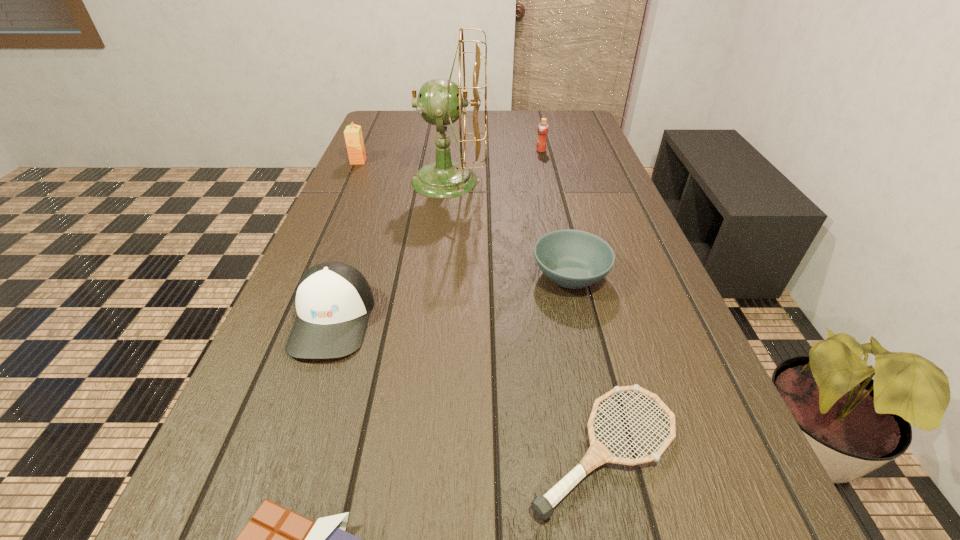
At what (x,y) coordinates should I click in order to perform the action: click on the tallest object. Please return your answer as a coordinate pair (x, y). The width and height of the screenshot is (960, 540). Looking at the image, I should click on (438, 104).

The height and width of the screenshot is (540, 960). What are the coordinates of `the nearer orange juice` in the screenshot? It's located at (353, 134).

Locate an element on the screen. The width and height of the screenshot is (960, 540). the farther orange juice is located at coordinates (543, 127).

Identify the location of the farthest object. Image resolution: width=960 pixels, height=540 pixels. (543, 127).

Identify the location of cap. The image size is (960, 540). (333, 300).

Find the location of a particular element. The image size is (960, 540). soup bowl is located at coordinates (574, 259).

This screenshot has height=540, width=960. I want to click on tennis racket, so click(598, 454).

Where is `vacant space located in front of the fan, directing air flow`? vacant space located in front of the fan, directing air flow is located at coordinates (517, 181).

This screenshot has width=960, height=540. I want to click on free space located 0.170m on the back of the nearer orange juice, so click(371, 135).

Identify the location of vacant space located 0.150m on the left of the right orange juice. This screenshot has height=540, width=960. (489, 151).